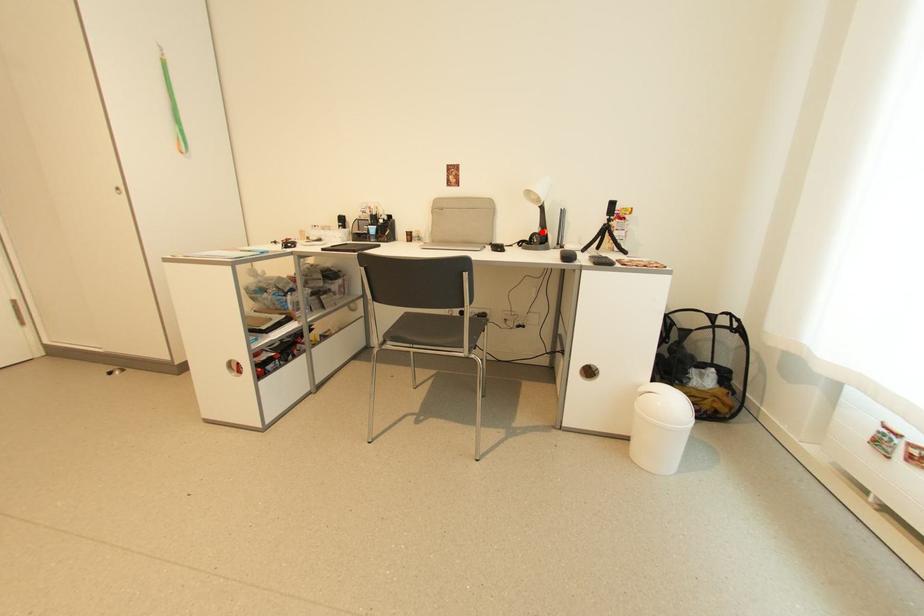
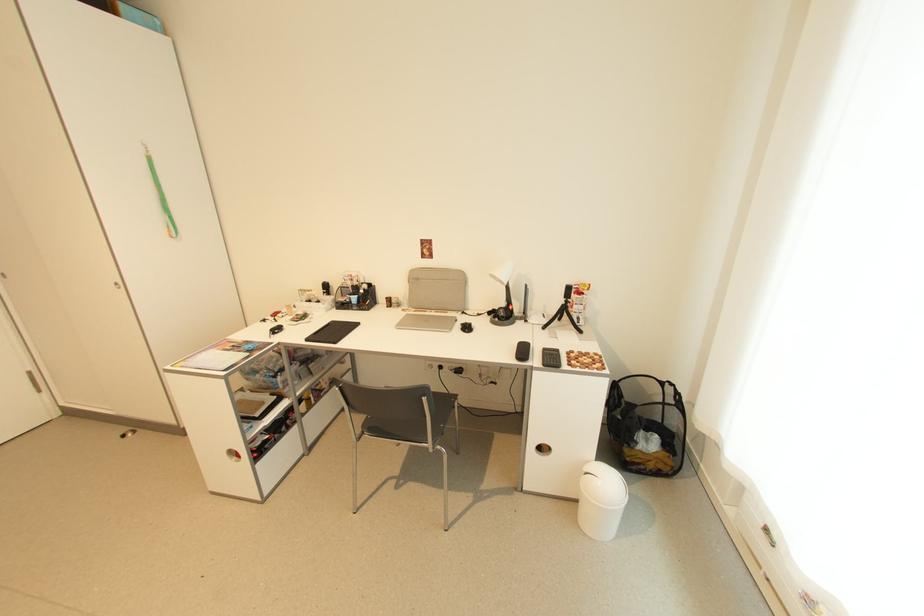
Find the pixel in the second image that matches the highlighted location in the first image.

(507, 306)